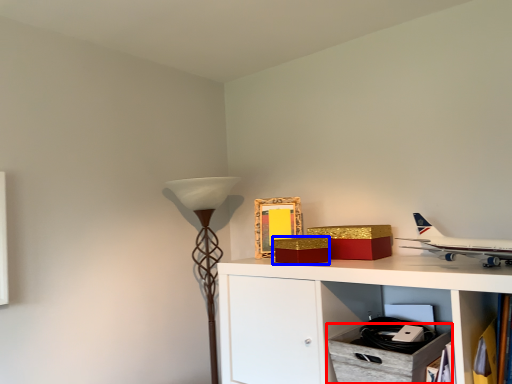
Question: Among these objects, which one is farthest to the camera, drawer (highlighted by a red box) or box (highlighted by a blue box)?

Choices:
 (A) drawer
 (B) box

Answer: (B)